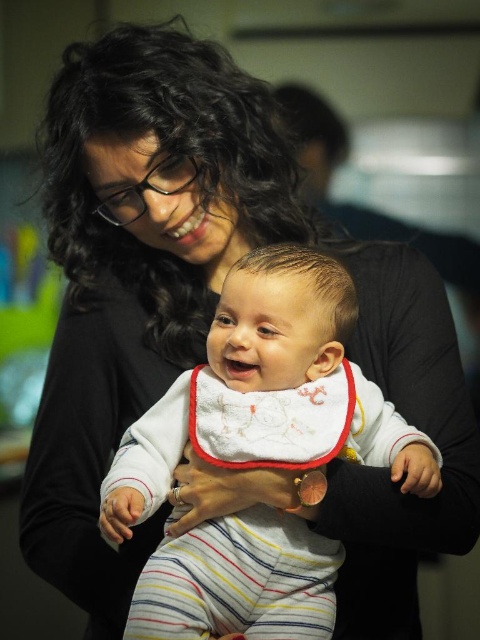
Can you confirm if white soft fabric baby at center is positioned to the right of white embroidered bib at center?

No, white soft fabric baby at center is not to the right of white embroidered bib at center.

Which is in front, point (316, 257) or point (299, 438)?

Point (299, 438) is in front.

The height and width of the screenshot is (640, 480). In order to click on white soft fabric baby at center in this screenshot , I will do `click(267, 392)`.